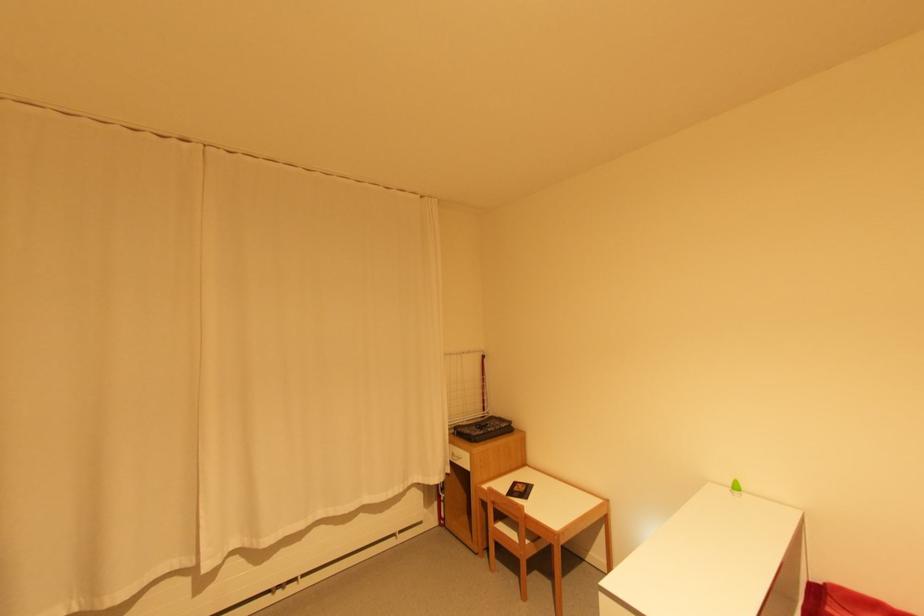
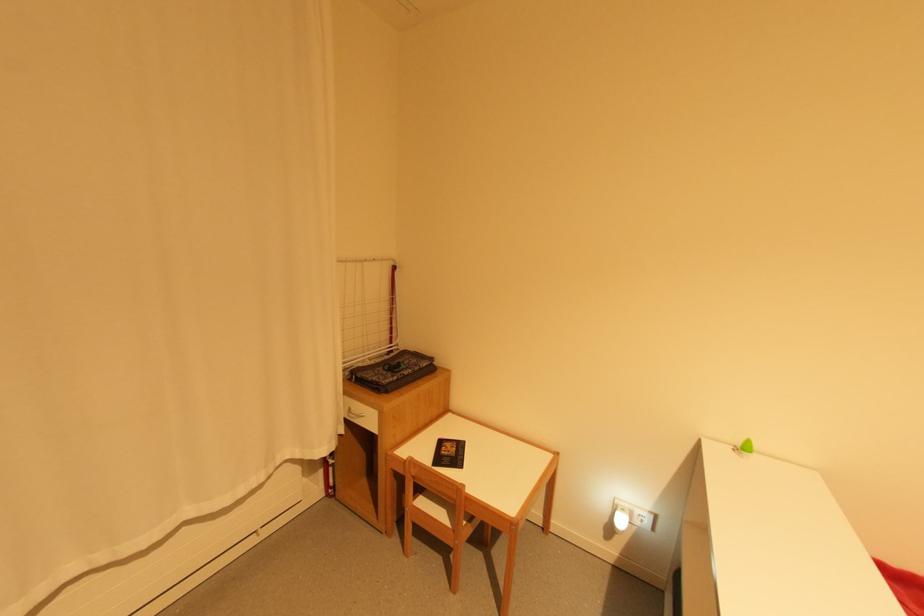
The point at (519, 484) is marked in the first image. Where is the corresponding point in the second image?

(445, 443)